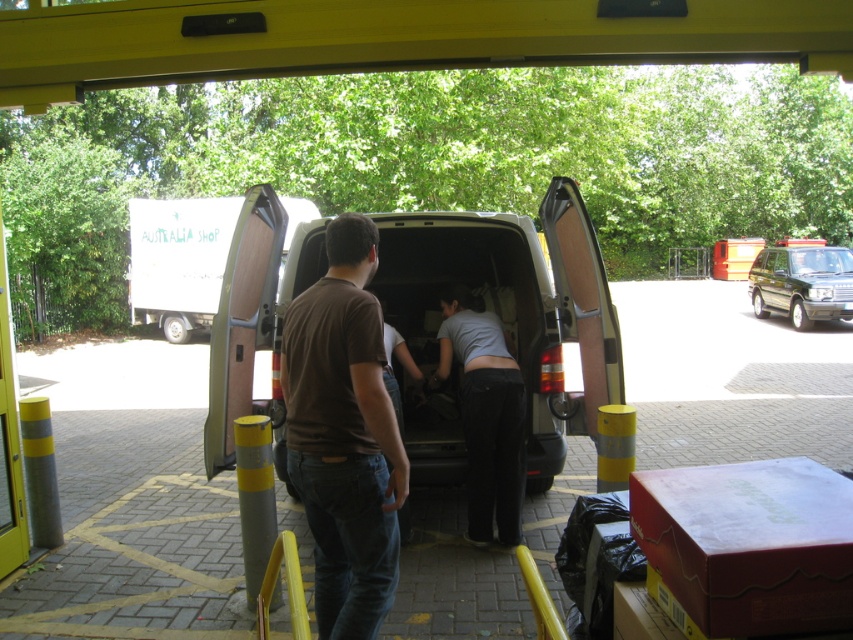
Question: Does matte gray van at center appear on the left side of green matte suv at right?

Choices:
 (A) no
 (B) yes

Answer: (B)

Question: Considering the relative positions of matte gray van at center and brown cotton t-shirt at center in the image provided, where is matte gray van at center located with respect to brown cotton t-shirt at center?

Choices:
 (A) right
 (B) left

Answer: (A)

Question: Among these points, which one is farthest from the camera?

Choices:
 (A) (247, 268)
 (B) (790, 310)

Answer: (B)

Question: Does matte gray van at center lie in front of brown cotton t-shirt at center?

Choices:
 (A) no
 (B) yes

Answer: (A)

Question: Estimate the real-world distances between objects in this image. Which object is farther from the green matte suv at right?

Choices:
 (A) brown cotton t-shirt at center
 (B) matte gray van at center

Answer: (A)

Question: Among these points, which one is nearest to the camera?

Choices:
 (A) (799, 305)
 (B) (276, 218)

Answer: (B)